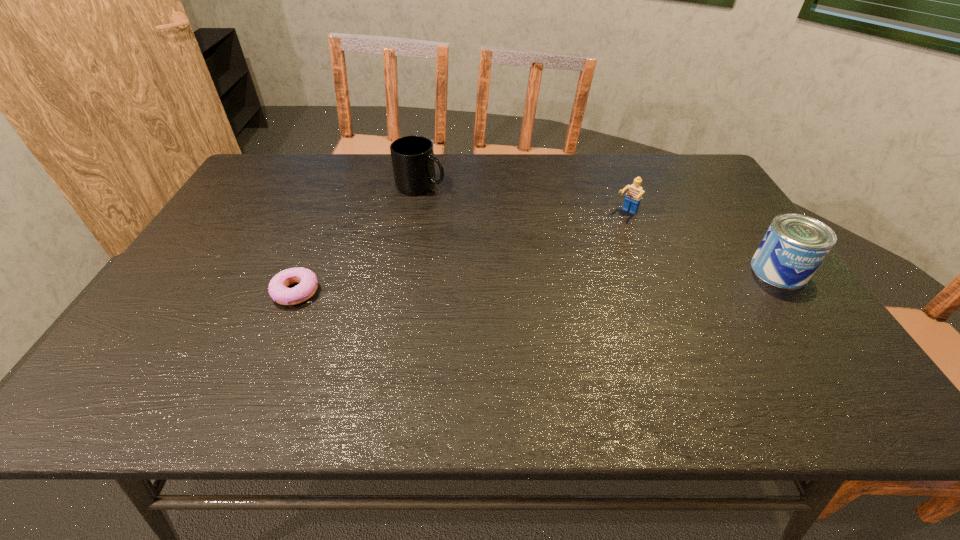
At what (x,y) coordinates should I click in order to perform the action: click on free space between the rightmost object and the leftmost object. Please return your answer as a coordinate pair (x, y). The height and width of the screenshot is (540, 960). Looking at the image, I should click on (538, 281).

Select which object appears as the second closest to the leftmost object. Please provide its 2D coordinates. Your answer should be formatted as a tuple, i.e. [(x, y)], where the tuple contains the x and y coordinates of a point satisfying the conditions above.

[(633, 197)]

Image resolution: width=960 pixels, height=540 pixels. In order to click on object that is the nearest to the farthest object in this screenshot , I will do `click(307, 280)`.